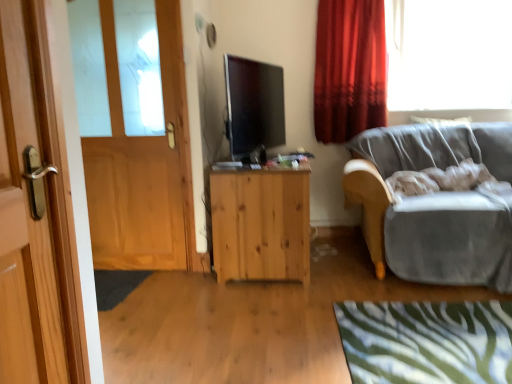
Find the location of a particular element. This screenshot has width=512, height=384. red velvet curtain at upper right is located at coordinates (349, 69).

The height and width of the screenshot is (384, 512). Describe the element at coordinates (449, 54) in the screenshot. I see `transparent glass window at upper right` at that location.

What is the approximate height of transparent glass window at upper right?

The height of transparent glass window at upper right is 35.28 inches.

The height and width of the screenshot is (384, 512). Describe the element at coordinates (426, 341) in the screenshot. I see `green zebra-patterned rug at lower right` at that location.

Describe the element at coordinates (28, 209) in the screenshot. I see `wooden door at left, arranged as the 1th door when viewed from the front` at that location.

What do you see at coordinates (260, 223) in the screenshot? The height and width of the screenshot is (384, 512). I see `natural wood cabinet at center` at bounding box center [260, 223].

You are a GUI agent. You are given a task and a screenshot of the screen. Output one action in this format:
    pyautogui.click(x=<x>, y=<y>)
    Task: Click on the natural wood cabinet at center
    Image resolution: width=512 pixels, height=384 pixels.
    Given the screenshot: What is the action you would take?
    pyautogui.click(x=260, y=223)

What is the approximate width of wooden door at left, positioned as the second door in right-to-left order?

3.97 inches.

What are the coordinates of `red velvet curtain at upper right` in the screenshot? It's located at (349, 69).

Which object is positioned more to the right, matte black tv at center or natural wood cabinet at center?

Positioned to the right is natural wood cabinet at center.

Which object is closer to the camera, matte black tv at center or natural wood cabinet at center?

matte black tv at center is more forward.

Considering the relative sizes of matte black tv at center and natural wood cabinet at center in the image provided, is matte black tv at center taller than natural wood cabinet at center?

No, matte black tv at center is not taller than natural wood cabinet at center.

Which is correct: matte black tv at center is inside natural wood cabinet at center, or outside of it?

matte black tv at center is not enclosed by natural wood cabinet at center.

From a real-world perspective, is red velvet curtain at upper right physically above natural wood cabinet at center?

Yes, from a real-world perspective, red velvet curtain at upper right is on top of natural wood cabinet at center.

Can you confirm if red velvet curtain at upper right is shorter than natural wood cabinet at center?

In fact, red velvet curtain at upper right may be taller than natural wood cabinet at center.

Which object is thinner, red velvet curtain at upper right or natural wood cabinet at center?

red velvet curtain at upper right.

Are red velvet curtain at upper right and natural wood cabinet at center beside each other?

No, red velvet curtain at upper right is not in contact with natural wood cabinet at center.

Is wooden door at left, arranged as the 1th door when viewed from the front, inside or outside of matte black tv at center?

wooden door at left, arranged as the 1th door when viewed from the front, is located beyond the bounds of matte black tv at center.

Between wooden door at left, arranged as the 1th door when viewed from the front, and matte black tv at center, which one has larger width?

With larger width is matte black tv at center.

Is wooden door at left, the 2th door from the back, to the left or to the right of matte black tv at center in the image?

Based on their positions, wooden door at left, the 2th door from the back, is located to the left of matte black tv at center.

Could you tell me if transparent glass window at upper right is turned towards velvet gray couch at right?

No, transparent glass window at upper right is not oriented towards velvet gray couch at right.

Is transparent glass window at upper right not inside velvet gray couch at right?

Yes.

Considering the relative positions of transparent glass window at upper right and velvet gray couch at right in the image provided, is transparent glass window at upper right to the right of velvet gray couch at right from the viewer's perspective?

Yes.

From the image's perspective, is green zebra-patterned rug at lower right positioned above or below wooden door at left, arranged as the 1th door when viewed from the front?

From the image's perspective, green zebra-patterned rug at lower right appears below wooden door at left, arranged as the 1th door when viewed from the front.

Is green zebra-patterned rug at lower right at the right side of wooden door at left, placed as the second door when sorted from left to right?

Indeed, green zebra-patterned rug at lower right is positioned on the right side of wooden door at left, placed as the second door when sorted from left to right.

Where is `door in front of the green zebra-patterned rug at lower right`? door in front of the green zebra-patterned rug at lower right is located at coordinates point(28,209).

Is the depth of green zebra-patterned rug at lower right less than that of wooden door at left, placed as the second door when sorted from left to right?

No, it is not.

Which of these two, wooden door at left, which is the 2th door from front to back, or red velvet curtain at upper right, is bigger?

red velvet curtain at upper right is bigger.

Find the location of a particular element. curtain behind the wooden door at left, which is the 2th door from front to back is located at coordinates (349, 69).

Considering the sizes of objects wooden door at left, which is the first door from back to front, and red velvet curtain at upper right in the image provided, who is wider, wooden door at left, which is the first door from back to front, or red velvet curtain at upper right?

red velvet curtain at upper right is wider.

Does point (173, 19) come behind point (386, 32)?

No.

From a real-world perspective, relative to transparent glass window at upper right, is wooden door at left, which is the first door from back to front, vertically above or below?

Clearly, from a real-world perspective, wooden door at left, which is the first door from back to front, is below transparent glass window at upper right.

Starting from the transparent glass window at upper right, which door is the 2nd one to the left? Please provide its 2D coordinates.

[(134, 132)]

In terms of size, does wooden door at left, which is the first door from back to front, appear bigger or smaller than transparent glass window at upper right?

wooden door at left, which is the first door from back to front, is smaller than transparent glass window at upper right.

The image size is (512, 384). Identify the location of cabinetry below the matte black tv at center (from a real-world perspective). (260, 223).

Where is `curtain behind the natural wood cabinet at center`? This screenshot has width=512, height=384. curtain behind the natural wood cabinet at center is located at coordinates (349, 69).

Which object lies nearer to the anchor point velvet gray couch at right, red velvet curtain at upper right or wooden door at left, arranged as the 1th door when viewed from the front?

The object closer to velvet gray couch at right is red velvet curtain at upper right.

Looking at the image, which one is located closer to wooden door at left, positioned as the second door in right-to-left order, green zebra-patterned rug at lower right or natural wood cabinet at center?

Among the two, natural wood cabinet at center is located nearer to wooden door at left, positioned as the second door in right-to-left order.

Based on their spatial positions, is wooden door at left, which ranks as the 1th door in left-to-right order, or matte black tv at center closer to velvet gray couch at right?

matte black tv at center.

Considering their positions, is green zebra-patterned rug at lower right positioned further to wooden door at left, placed as the second door when sorted from left to right, than red velvet curtain at upper right?

red velvet curtain at upper right is positioned further to the anchor wooden door at left, placed as the second door when sorted from left to right.

Which object lies nearer to the anchor point natural wood cabinet at center, wooden door at left, arranged as the first door when viewed from the right, or transparent glass window at upper right?

wooden door at left, arranged as the first door when viewed from the right, is closer to natural wood cabinet at center.

Considering their positions, is red velvet curtain at upper right positioned further to natural wood cabinet at center than wooden door at left, placed as the second door when sorted from left to right?

wooden door at left, placed as the second door when sorted from left to right, is positioned further to the anchor natural wood cabinet at center.

Estimate the real-world distances between objects in this image. Which object is further from transparent glass window at upper right, velvet gray couch at right or red velvet curtain at upper right?

velvet gray couch at right is further to transparent glass window at upper right.

Based on their spatial positions, is matte black tv at center or transparent glass window at upper right further from velvet gray couch at right?

matte black tv at center is further to velvet gray couch at right.

This screenshot has height=384, width=512. Identify the location of studio couch between wooden door at left, which ranks as the 1th door in left-to-right order, and transparent glass window at upper right, in the horizontal direction. (451, 239).

The width and height of the screenshot is (512, 384). In order to click on television between wooden door at left, positioned as the second door in right-to-left order, and velvet gray couch at right, in the horizontal direction in this screenshot , I will do `click(253, 106)`.

Where is `plain positioned between wooden door at left, the 2th door from the back, and matte black tv at center from near to far`? The width and height of the screenshot is (512, 384). plain positioned between wooden door at left, the 2th door from the back, and matte black tv at center from near to far is located at coordinates (426, 341).

Find the location of `curtain between wooden door at left, which is the 2th door from front to back, and velvet gray couch at right from left to right`. curtain between wooden door at left, which is the 2th door from front to back, and velvet gray couch at right from left to right is located at coordinates (349, 69).